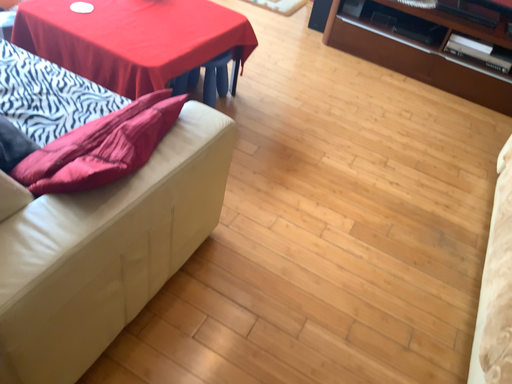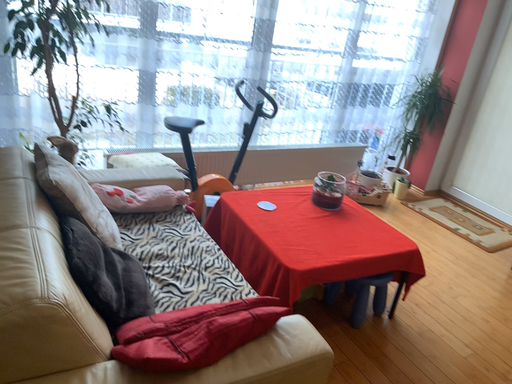
Question: How did the camera likely rotate when shooting the video?

Choices:
 (A) rotated left
 (B) rotated right

Answer: (A)